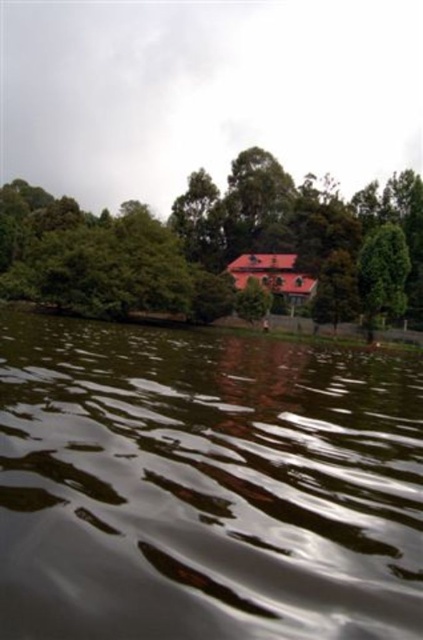
Question: Among these points, which one is farthest from the camera?

Choices:
 (A) (101, 220)
 (B) (252, 468)

Answer: (A)

Question: Is dark reflective water at center positioned behind green leafy tree at upper center?

Choices:
 (A) no
 (B) yes

Answer: (A)

Question: Can you confirm if dark reflective water at center is positioned to the left of green leafy tree at upper center?

Choices:
 (A) yes
 (B) no

Answer: (B)

Question: Is dark reflective water at center closer to the viewer compared to green leafy tree at upper center?

Choices:
 (A) yes
 (B) no

Answer: (A)

Question: Which of the following is the farthest from the observer?

Choices:
 (A) green leafy tree at upper center
 (B) dark reflective water at center

Answer: (A)